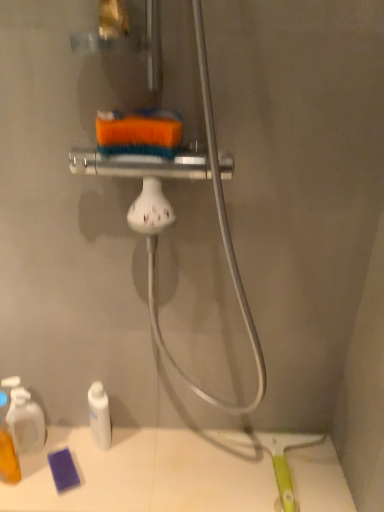
I want to click on vacant area located to the right-hand side of translucent plastic spray bottle at lower left, placed as the second toiletry when sorted from right to left, so click(x=89, y=459).